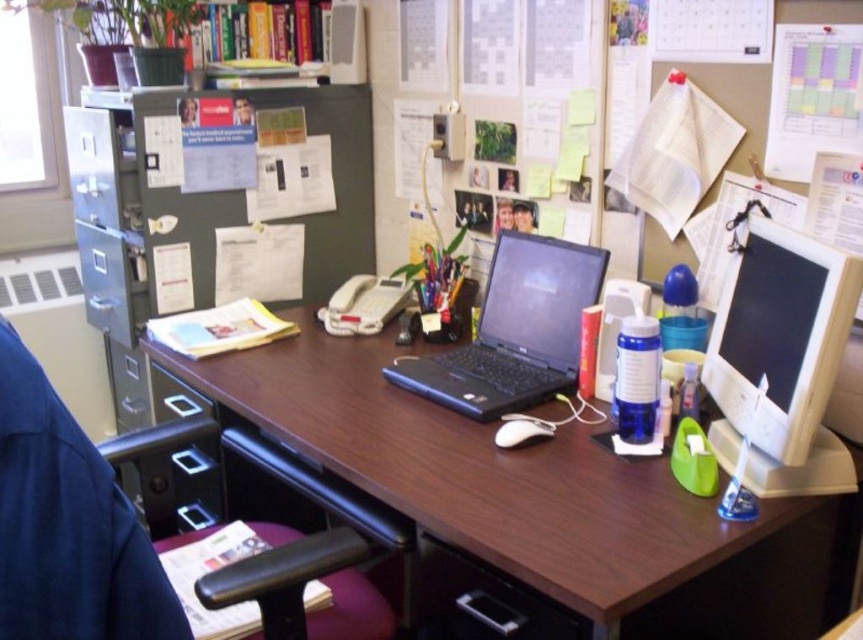
You are organizing the office and need to move the metallic gray file cabinet at left. Since the brown wood computer desk at center is in the way, can you slide it out from under the cabinet?

The brown wood computer desk at center is positioned under the metallic gray file cabinet at left, so it is not possible to slide the desk out from under the cabinet as it is already positioned there.

You are organizing your workspace and need to move a heavy box from the brown wood computer desk at center to the matte plastic drawer at lower left. Based on their positions, will you have to move the box to the left or to the right to place it in the drawer?

The brown wood computer desk at center is to the right of the matte plastic drawer at lower left, so you will need to move the box to the left to place it in the drawer.

You need to move a large box that is 1 meter wide through the space between the dark blue fabric swivel chair at left and the black plastic drawer at lower left. Can you fit the box through that space?

The dark blue fabric swivel chair at left occupies less space than the black plastic drawer at lower left, so the space between them may be sufficient for the box. However, without knowing the exact distance between them, it is uncertain if the 1 meter wide box will fit.